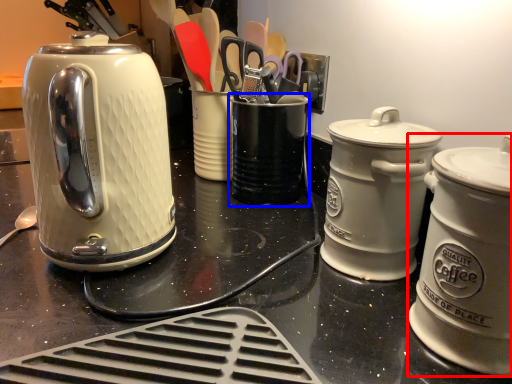
Question: Which object appears closest to the camera in this image, kitchen appliance (highlighted by a red box) or appliance (highlighted by a blue box)?

Choices:
 (A) kitchen appliance
 (B) appliance

Answer: (A)